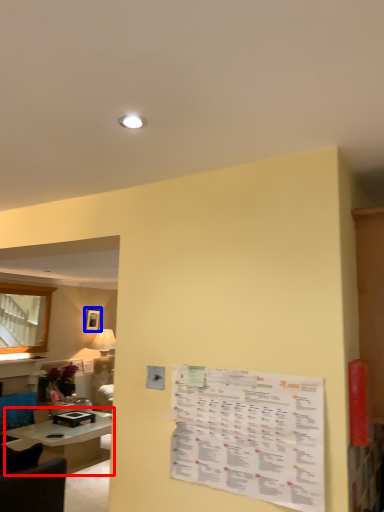
Question: Which object appears farthest to the camera in this image, table (highlighted by a red box) or picture frame (highlighted by a blue box)?

Choices:
 (A) table
 (B) picture frame

Answer: (B)